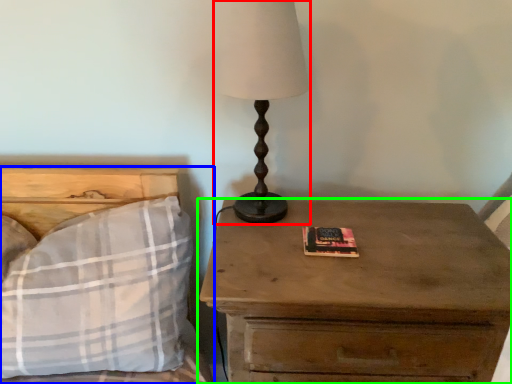
Question: Estimate the real-world distances between objects in this image. Which object is closer to table lamp (highlighted by a red box), bed (highlighted by a blue box) or nightstand (highlighted by a green box)?

Choices:
 (A) bed
 (B) nightstand

Answer: (B)